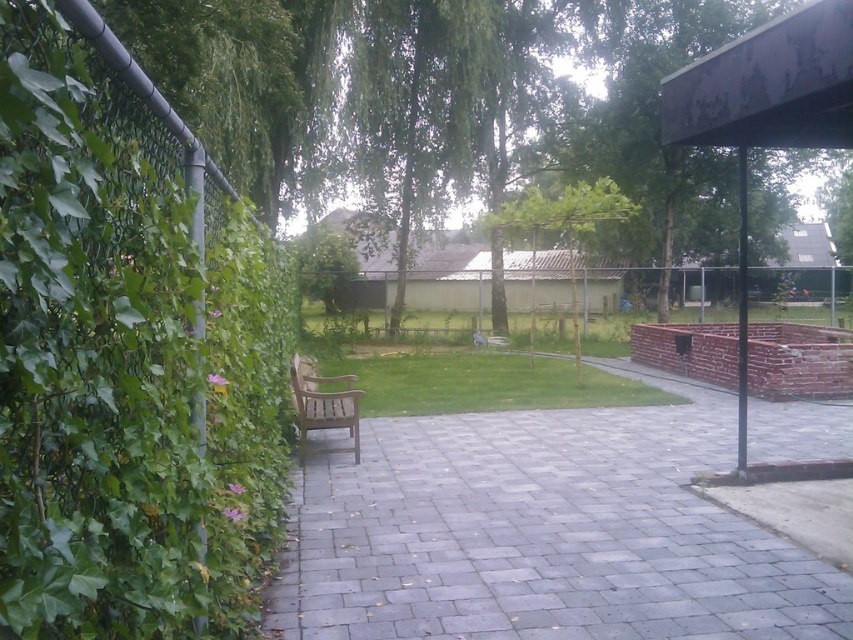
You are planning to plant a new flower bed between the green leafy hedge at left and the green leafy tree at upper right. Based on their positions, which object is closer to the ground where you can start digging?

The green leafy hedge at left is positioned under the green leafy tree at upper right, so the hedge is closer to the ground. Start digging near the green leafy hedge at left.

You are standing at the point labeled as point (126,364) in the image. What object is located at this point?

The point (126,364) corresponds to the green leafy hedge at left.